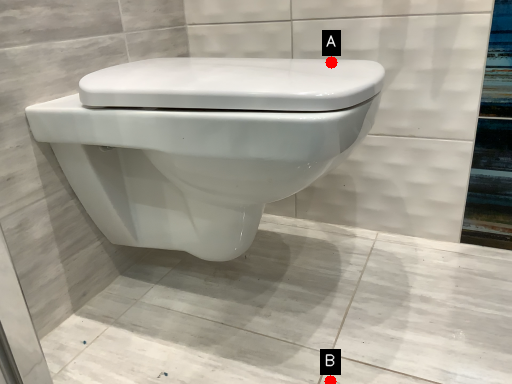
Question: Two points are circled on the image, labeled by A and B beside each circle. Among these points, which one is nearest to the camera?

Choices:
 (A) A is closer
 (B) B is closer

Answer: (B)